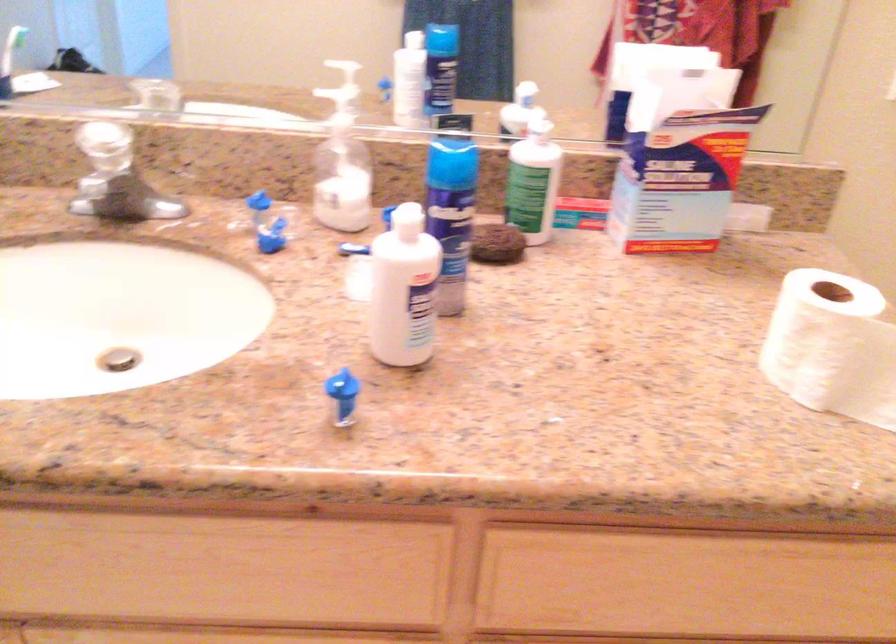
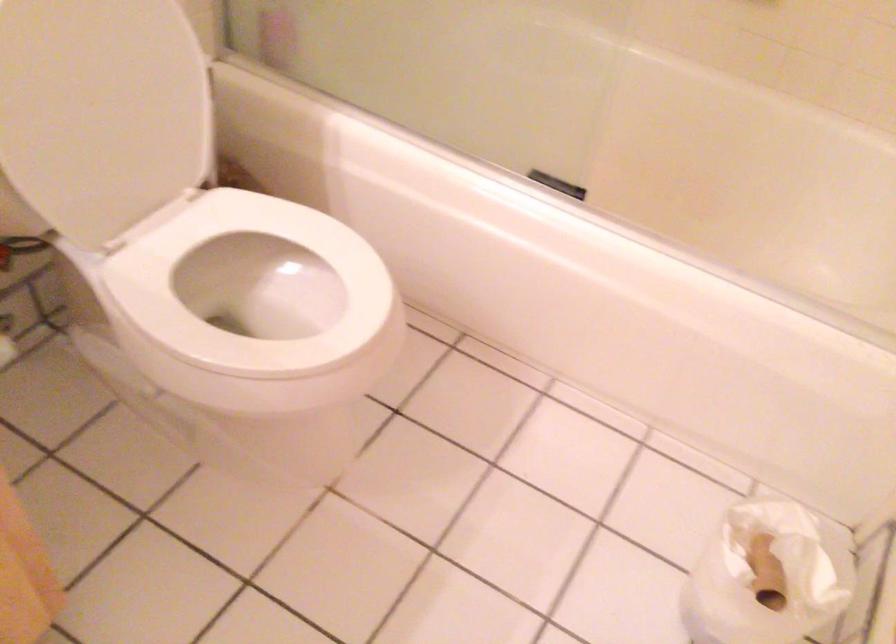
How did the camera likely rotate?

The rotation direction of the camera is right-down.